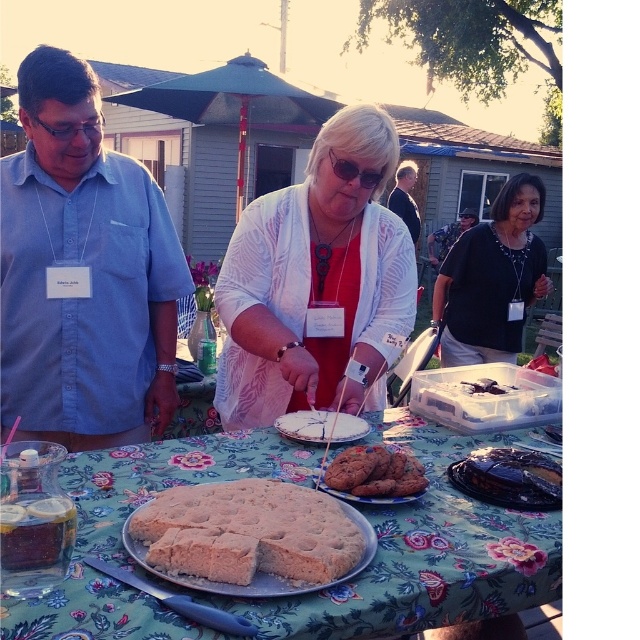
Which is in front, point (460, 275) or point (321, 429)?

Point (321, 429)

Is point (456, 264) in front of point (275, 428)?

No, (456, 264) is behind (275, 428).

Find the location of `matte black shirt at center`. matte black shirt at center is located at coordinates (492, 278).

Does matte blue shirt at left come behind chocolate chip cookies at center?

Yes, it is behind chocolate chip cookies at center.

Is point (44, 294) positioned in front of point (364, 477)?

That is False.

Between point (58, 65) and point (328, 481), which one is positioned behind?

The point (58, 65) is more distant.

Locate an element on the screen. matte blue shirt at left is located at coordinates (83, 273).

Based on the photo, does matte black shirt at center have a smaller size compared to dark blue shirt at center?

Yes.

Who is higher up, matte black shirt at center or dark blue shirt at center?

dark blue shirt at center

The image size is (640, 640). Describe the element at coordinates (492, 278) in the screenshot. I see `matte black shirt at center` at that location.

At what (x,y) coordinates should I click in order to perform the action: click on matte black shirt at center. Please return your answer as a coordinate pair (x, y). The width and height of the screenshot is (640, 640). Looking at the image, I should click on (492, 278).